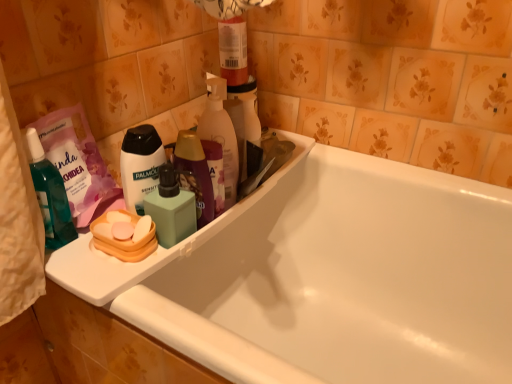
Identify the location of vacant area that lies to the right of translucent teal bottle at left, the second toiletry from the right. (122, 269).